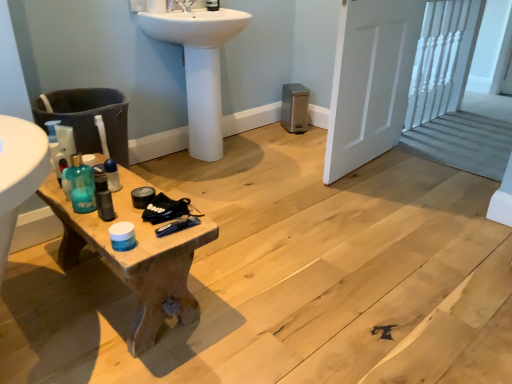
This screenshot has height=384, width=512. Find the location of `empty space that is in between white wooden door at right and white glossy sink at upper center`. empty space that is in between white wooden door at right and white glossy sink at upper center is located at coordinates (275, 159).